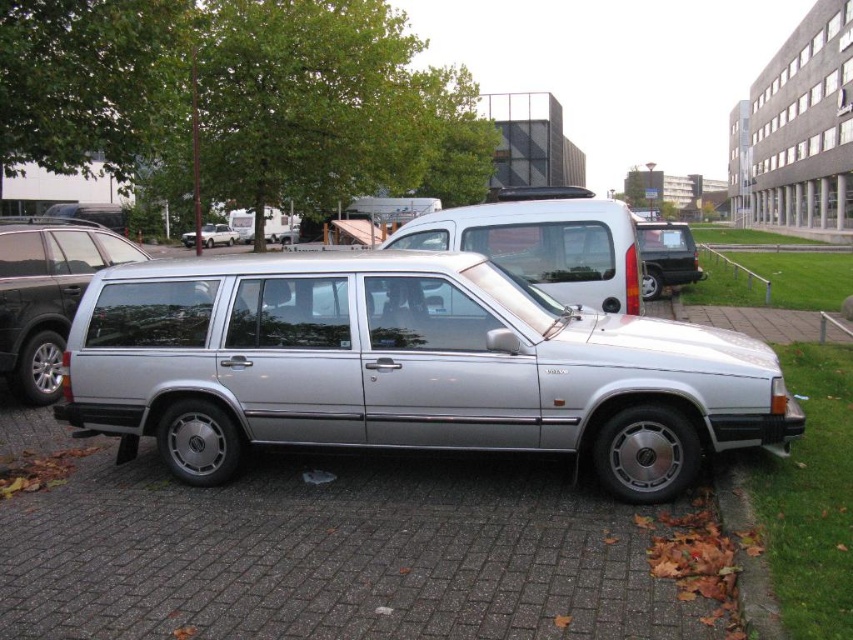
Please provide the coordinates of the silver metallic station wagon at center in the image. The coordinate system uses the bottom left corner as the origin point. The answer should be in the format of point followed by the coordinates in parentheses, e.g., point A at point B.

The silver metallic station wagon at center is located at point (405, 368).

You are a delivery person trying to park your van in the parking lot. You see the gray brick pavement at center and the satin silver station wagon at center. Which one is shorter in height?

The gray brick pavement at center is shorter than the satin silver station wagon at center, so the gray brick pavement at center is the shorter one.

In the scene shown: You are a delivery driver who needs to back out of the parking spot. You see the silver metallic minivan at left and the satin silver station wagon at center. Which vehicle is blocking your path?

The silver metallic minivan at left is blocking your path because it is positioned in front of the satin silver station wagon at center, which you are parked next to.